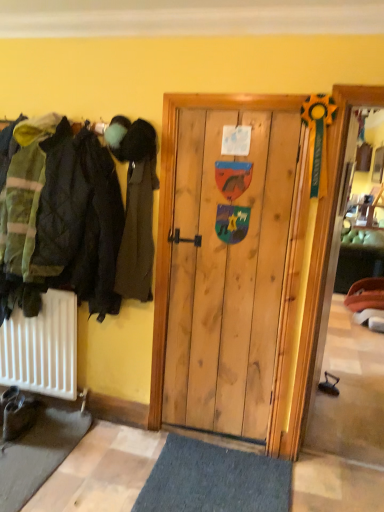
Question: Is point (140, 125) closer or farther from the camera than point (9, 429)?

Choices:
 (A) closer
 (B) farther

Answer: (A)

Question: From the image's perspective, is dark green fabric coat at left positioned above or below brown leather boot at lower left?

Choices:
 (A) above
 (B) below

Answer: (A)

Question: Is dark green fabric coat at left wider or thinner than brown leather boot at lower left?

Choices:
 (A) wide
 (B) thin

Answer: (B)

Question: Is brown leather boot at lower left to the left or to the right of dark green fabric coat at left in the image?

Choices:
 (A) left
 (B) right

Answer: (A)

Question: From their relative heights in the image, would you say brown leather boot at lower left is taller or shorter than dark green fabric coat at left?

Choices:
 (A) tall
 (B) short

Answer: (B)

Question: Is brown leather boot at lower left inside the boundaries of dark green fabric coat at left, or outside?

Choices:
 (A) outside
 (B) inside

Answer: (A)

Question: From the image's perspective, relative to dark green fabric coat at left, is brown leather boot at lower left above or below?

Choices:
 (A) below
 (B) above

Answer: (A)